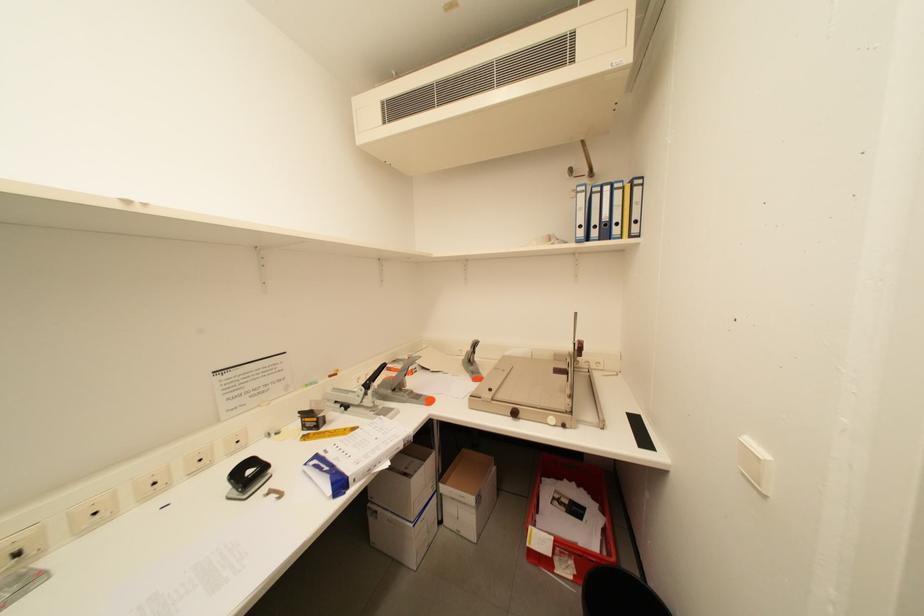
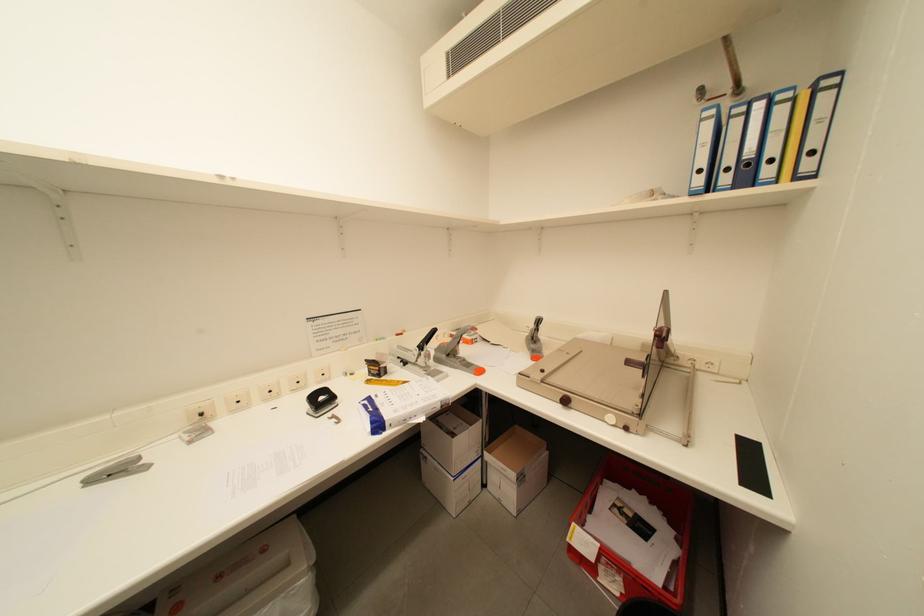
Question: The camera is either moving clockwise (left) or counter-clockwise (right) around the object. The first image is from the beginning of the video and the second image is from the end. Is the camera moving left or right when shooting the video?

Choices:
 (A) Left
 (B) Right

Answer: (B)